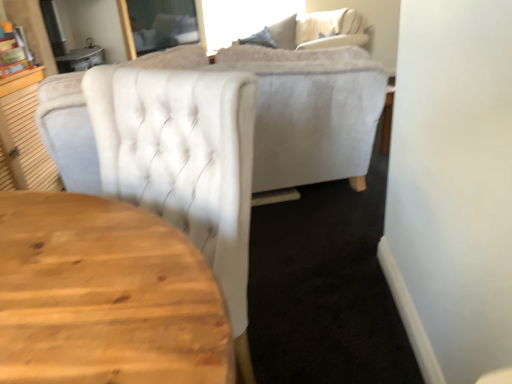
Question: Can you confirm if white tufted chair at upper center is taller than velvet beige couch at upper center?

Choices:
 (A) no
 (B) yes

Answer: (B)

Question: Is white tufted chair at upper center thinner than velvet beige couch at upper center?

Choices:
 (A) no
 (B) yes

Answer: (B)

Question: Is white tufted chair at upper center shorter than velvet beige couch at upper center?

Choices:
 (A) no
 (B) yes

Answer: (A)

Question: Is white tufted chair at upper center bigger than velvet beige couch at upper center?

Choices:
 (A) yes
 (B) no

Answer: (B)

Question: Is the position of white tufted chair at upper center more distant than that of velvet beige couch at upper center?

Choices:
 (A) no
 (B) yes

Answer: (A)

Question: From a real-world perspective, is white tufted chair at upper center physically below velvet beige couch at upper center?

Choices:
 (A) yes
 (B) no

Answer: (B)

Question: From the image's perspective, would you say velvet beige couch at upper center is shown under white tufted chair at upper center?

Choices:
 (A) yes
 (B) no

Answer: (B)

Question: Would you consider velvet beige couch at upper center to be distant from white tufted chair at upper center?

Choices:
 (A) yes
 (B) no

Answer: (A)

Question: Is velvet beige couch at upper center facing away from white tufted chair at upper center?

Choices:
 (A) yes
 (B) no

Answer: (B)

Question: From a real-world perspective, is velvet beige couch at upper center below white tufted chair at upper center?

Choices:
 (A) yes
 (B) no

Answer: (A)

Question: Can you confirm if velvet beige couch at upper center is positioned to the left of white tufted chair at upper center?

Choices:
 (A) no
 (B) yes

Answer: (A)

Question: Is velvet beige couch at upper center taller than white tufted chair at upper center?

Choices:
 (A) no
 (B) yes

Answer: (A)

Question: Relative to velvet beige couch at upper center, is white tufted chair at upper center in front or behind?

Choices:
 (A) front
 (B) behind

Answer: (A)